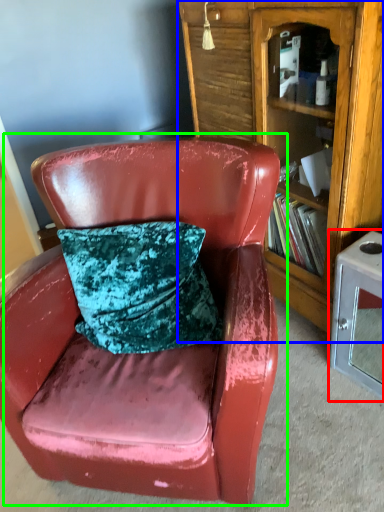
Question: Considering the real-world distances, which object is closest to table (highlighted by a red box)? bookcase (highlighted by a blue box) or chair (highlighted by a green box).

Choices:
 (A) bookcase
 (B) chair

Answer: (A)